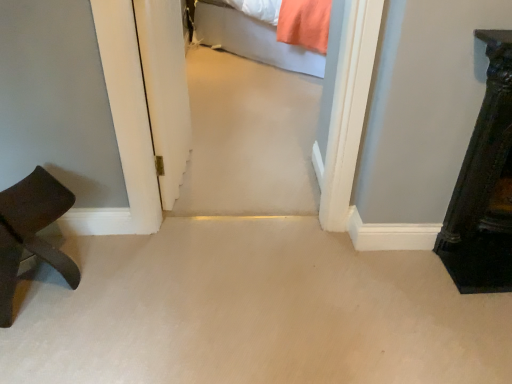
You are a GUI agent. You are given a task and a screenshot of the screen. Output one action in this format:
    pyautogui.click(x=<x>, y=<y>)
    Task: Click on the free space underneath dark brown wood stool at left, which is counted as the 2th furniture, starting from the right (from a real-world perspective)
    The image size is (512, 384).
    Given the screenshot: What is the action you would take?
    pyautogui.click(x=46, y=284)